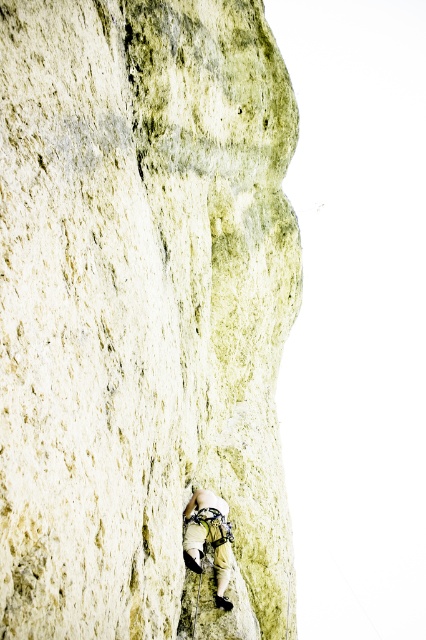
From the picture: You are a rock climber who wants to take a photo of the yellowish rock at center from a distance of 15 meters. Can you do it while standing at the base of the cliff?

The yellowish rock at center and camera are 14.93 meters apart, so yes, you can take the photo from the base of the cliff since the distance is just under 15 meters.

You are standing at the base of the cliff and want to reach the point marked at coordinates point (198, 120). If you have a 40 meter rope, will it be sufficient to reach that point?

The point (198, 120) is 39.53 meters away from the viewer. Since the rope is 40 meters long, it will be sufficient to reach the point as it is longer than the distance required.